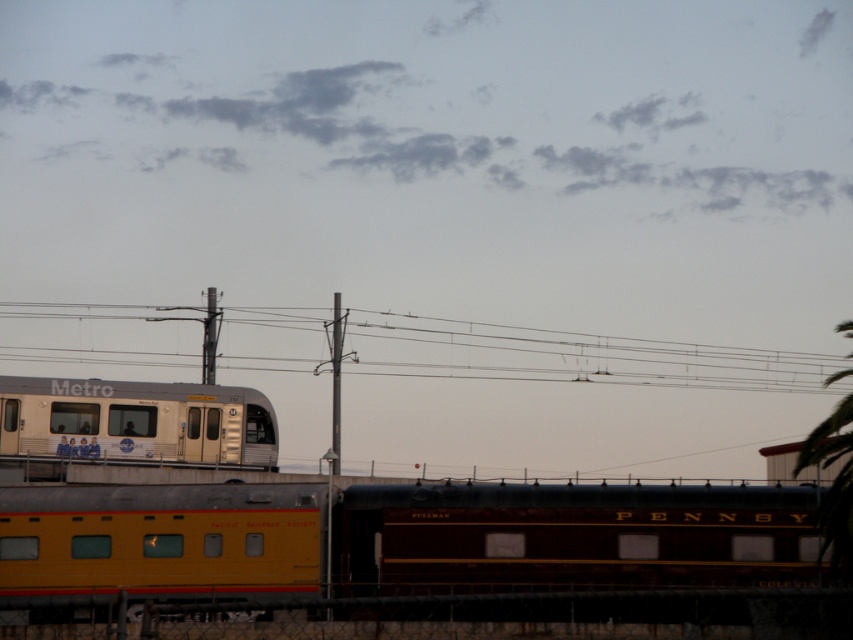
Question: Based on their relative distances, which object is nearer to the yellow polished wood train at lower left?

Choices:
 (A) silver metallic train at left
 (B) metallic wires at upper center

Answer: (A)

Question: Is the position of metallic wires at upper center more distant than that of green leafy tree at right?

Choices:
 (A) no
 (B) yes

Answer: (B)

Question: Is the position of yellow polished wood train at lower left less distant than that of metallic wires at upper center?

Choices:
 (A) no
 (B) yes

Answer: (B)

Question: Which object is closer to the camera taking this photo?

Choices:
 (A) yellow polished wood train at lower left
 (B) metallic wires at upper center

Answer: (A)

Question: Is yellow polished wood train at lower left above metallic wires at upper center?

Choices:
 (A) yes
 (B) no

Answer: (B)

Question: Which object appears farthest from the camera in this image?

Choices:
 (A) green leafy tree at right
 (B) silver metallic train at left
 (C) yellow polished wood train at lower left
 (D) metallic wires at upper center

Answer: (D)